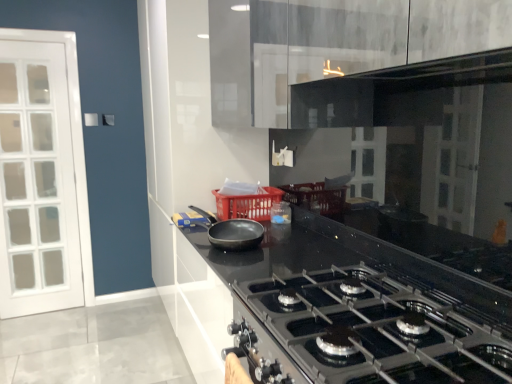
Describe the element at coordinates (248, 204) in the screenshot. I see `red plastic basket at center` at that location.

Find the location of a particular element. The height and width of the screenshot is (384, 512). black glossy countertop at center is located at coordinates (357, 310).

Locate an element on the screen. Image resolution: width=512 pixels, height=384 pixels. translucent plastic container at center is located at coordinates (281, 213).

From a real-world perspective, between matte black pan at center and translucent plastic container at center, who is vertically lower?

In real-world perspective, translucent plastic container at center is lower.

Is matte black pan at center closer to the viewer compared to translucent plastic container at center?

Yes, it is.

The image size is (512, 384). I want to click on appliance on the right of matte black pan at center, so click(x=281, y=213).

In order to click on countertop lying on the right of matte black pan at center in this screenshot , I will do `click(357, 310)`.

Is matte black pan at center not near black glossy countertop at center?

No, matte black pan at center is not far from black glossy countertop at center.

From a real-world perspective, is matte black pan at center physically above black glossy countertop at center?

Yes, from a real-world perspective, matte black pan at center is above black glossy countertop at center.

How much distance is there between matte black pan at center and black glossy countertop at center?

19.48 inches.

Is the position of red plastic basket at center more distant than that of matte black pan at center?

Yes, it is behind matte black pan at center.

From the image's perspective, which is below, red plastic basket at center or matte black pan at center?

matte black pan at center.

Considering the relative sizes of red plastic basket at center and matte black pan at center in the image provided, is red plastic basket at center smaller than matte black pan at center?

Incorrect, red plastic basket at center is not smaller in size than matte black pan at center.

Which object is thinner, red plastic basket at center or black glossy countertop at center?

red plastic basket at center is thinner.

Is red plastic basket at center far away from black glossy countertop at center?

That's not correct — red plastic basket at center is a little close to black glossy countertop at center.

Locate an element on the screen. The height and width of the screenshot is (384, 512). basket that appears above the black glossy countertop at center (from a real-world perspective) is located at coordinates (248, 204).

From the image's perspective, is red plastic basket at center located above black glossy countertop at center?

Yes.

Is red plastic basket at center wider than translucent plastic container at center?

Yes, red plastic basket at center is wider than translucent plastic container at center.

Consider the image. Which object is closer to the camera, red plastic basket at center or translucent plastic container at center?

red plastic basket at center.

Is red plastic basket at center located outside translucent plastic container at center?

red plastic basket at center lies outside translucent plastic container at center's area.

Can you confirm if red plastic basket at center is positioned to the right of translucent plastic container at center?

Incorrect, red plastic basket at center is not on the right side of translucent plastic container at center.

What's the angular difference between black glossy countertop at center and translucent plastic container at center's facing directions?

black glossy countertop at center and translucent plastic container at center are facing 0.000771 degrees away from each other.

Considering the sizes of black glossy countertop at center and translucent plastic container at center in the image, is black glossy countertop at center taller or shorter than translucent plastic container at center?

Clearly, black glossy countertop at center is taller compared to translucent plastic container at center.

Consider the image. Considering their positions, is black glossy countertop at center located in front of or behind translucent plastic container at center?

In the image, black glossy countertop at center appears in front of translucent plastic container at center.

Does black glossy countertop at center turn towards translucent plastic container at center?

No, black glossy countertop at center does not turn towards translucent plastic container at center.

Considering the positions of points (248, 245) and (267, 186), is point (248, 245) closer to camera compared to point (267, 186)?

Yes, point (248, 245) is in front of point (267, 186).

Is matte black pan at center positioned beyond the bounds of red plastic basket at center?

Yes.

Can you confirm if matte black pan at center is positioned to the right of red plastic basket at center?

In fact, matte black pan at center is to the left of red plastic basket at center.

This screenshot has width=512, height=384. Find the location of `appliance lying behind the matte black pan at center`. appliance lying behind the matte black pan at center is located at coordinates (281, 213).

Where is `kitchen appliance above the black glossy countertop at center (from a real-world perspective)`? This screenshot has width=512, height=384. kitchen appliance above the black glossy countertop at center (from a real-world perspective) is located at coordinates (232, 232).

When comparing their distances from red plastic basket at center, does translucent plastic container at center or matte black pan at center seem closer?

Based on the image, translucent plastic container at center appears to be nearer to red plastic basket at center.

Which object lies further to the anchor point translucent plastic container at center, red plastic basket at center or matte black pan at center?

The object further to translucent plastic container at center is matte black pan at center.

Looking at the image, which one is located closer to black glossy countertop at center, red plastic basket at center or matte black pan at center?

matte black pan at center lies closer to black glossy countertop at center than the other object.

From the image, which object appears to be nearer to matte black pan at center, translucent plastic container at center or red plastic basket at center?

Among the two, red plastic basket at center is located nearer to matte black pan at center.

From the image, which object appears to be nearer to translucent plastic container at center, matte black pan at center or red plastic basket at center?

Among the two, red plastic basket at center is located nearer to translucent plastic container at center.

Which object lies further to the anchor point translucent plastic container at center, red plastic basket at center or black glossy countertop at center?

black glossy countertop at center.

Based on their spatial positions, is matte black pan at center or black glossy countertop at center further from red plastic basket at center?

The object further to red plastic basket at center is black glossy countertop at center.

Estimate the real-world distances between objects in this image. Which object is closer to matte black pan at center, black glossy countertop at center or red plastic basket at center?

red plastic basket at center is closer to matte black pan at center.

The width and height of the screenshot is (512, 384). I want to click on basket between black glossy countertop at center and translucent plastic container at center along the z-axis, so click(x=248, y=204).

Locate an element on the screen. kitchen appliance positioned between black glossy countertop at center and translucent plastic container at center from near to far is located at coordinates (232, 232).

This screenshot has width=512, height=384. I want to click on kitchen appliance located between black glossy countertop at center and red plastic basket at center in the depth direction, so click(232, 232).

The height and width of the screenshot is (384, 512). What are the coordinates of `basket located between matte black pan at center and translucent plastic container at center in the depth direction` in the screenshot? It's located at (248, 204).